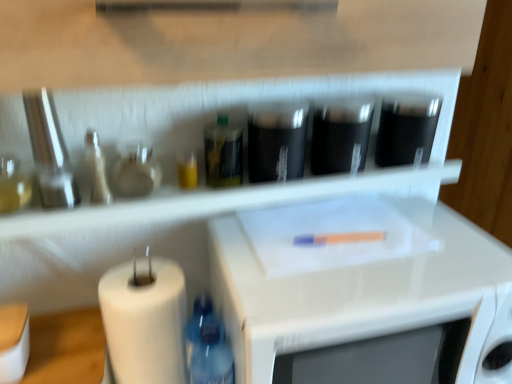
Question: Does white matte paper towel at lower left lie in front of black glossy cups at center, arranged as the third appliance when viewed from the right?

Choices:
 (A) no
 (B) yes

Answer: (B)

Question: Does white matte paper towel at lower left appear on the right side of black glossy cups at center, arranged as the third appliance when viewed from the right?

Choices:
 (A) yes
 (B) no

Answer: (B)

Question: From a real-world perspective, is white matte paper towel at lower left below black glossy cups at center, marked as the 2th appliance in a left-to-right arrangement?

Choices:
 (A) yes
 (B) no

Answer: (A)

Question: Considering the relative sizes of white matte paper towel at lower left and black glossy cups at center, arranged as the third appliance when viewed from the right, in the image provided, is white matte paper towel at lower left bigger than black glossy cups at center, arranged as the third appliance when viewed from the right,?

Choices:
 (A) yes
 (B) no

Answer: (A)

Question: Are white matte paper towel at lower left and black glossy cups at center, marked as the 2th appliance in a left-to-right arrangement, far apart?

Choices:
 (A) no
 (B) yes

Answer: (A)

Question: In the image, is black matte container at upper right, which appears as the 1th appliance when viewed from the right, on the left side or the right side of black matte container at center, placed as the 2th appliance when sorted from right to left?

Choices:
 (A) right
 (B) left

Answer: (A)

Question: Looking at the image, does black matte container at upper right, placed as the 4th appliance when sorted from left to right, seem bigger or smaller compared to black matte container at center, placed as the 3th appliance when sorted from left to right?

Choices:
 (A) small
 (B) big

Answer: (A)

Question: Choose the correct answer: Is black matte container at upper right, which appears as the 1th appliance when viewed from the right, inside black matte container at center, placed as the 3th appliance when sorted from left to right, or outside it?

Choices:
 (A) outside
 (B) inside

Answer: (A)

Question: From the image's perspective, is black matte container at upper right, placed as the 4th appliance when sorted from left to right, positioned above or below black matte container at center, placed as the 3th appliance when sorted from left to right?

Choices:
 (A) below
 (B) above

Answer: (B)

Question: From a real-world perspective, is metallic silver knife set at left, marked as the 4th appliance in a right-to-left arrangement, positioned above or below black matte container at center, placed as the 2th appliance when sorted from right to left?

Choices:
 (A) above
 (B) below

Answer: (A)

Question: Relative to black matte container at center, placed as the 3th appliance when sorted from left to right, is metallic silver knife set at left, marked as the 4th appliance in a right-to-left arrangement, in front or behind?

Choices:
 (A) front
 (B) behind

Answer: (A)

Question: From the image's perspective, is metallic silver knife set at left, marked as the 1th appliance in a left-to-right arrangement, above or below black matte container at center, placed as the 2th appliance when sorted from right to left?

Choices:
 (A) below
 (B) above

Answer: (A)

Question: Is metallic silver knife set at left, marked as the 1th appliance in a left-to-right arrangement, to the left or to the right of black matte container at center, placed as the 2th appliance when sorted from right to left, in the image?

Choices:
 (A) left
 (B) right

Answer: (A)

Question: Is point (212, 365) positioned closer to the camera than point (266, 175)?

Choices:
 (A) closer
 (B) farther

Answer: (A)

Question: Is blue plastic bottle at lower left, the second bottle in the left-to-right sequence, in front of or behind black glossy cups at center, marked as the 2th appliance in a left-to-right arrangement, in the image?

Choices:
 (A) behind
 (B) front

Answer: (B)